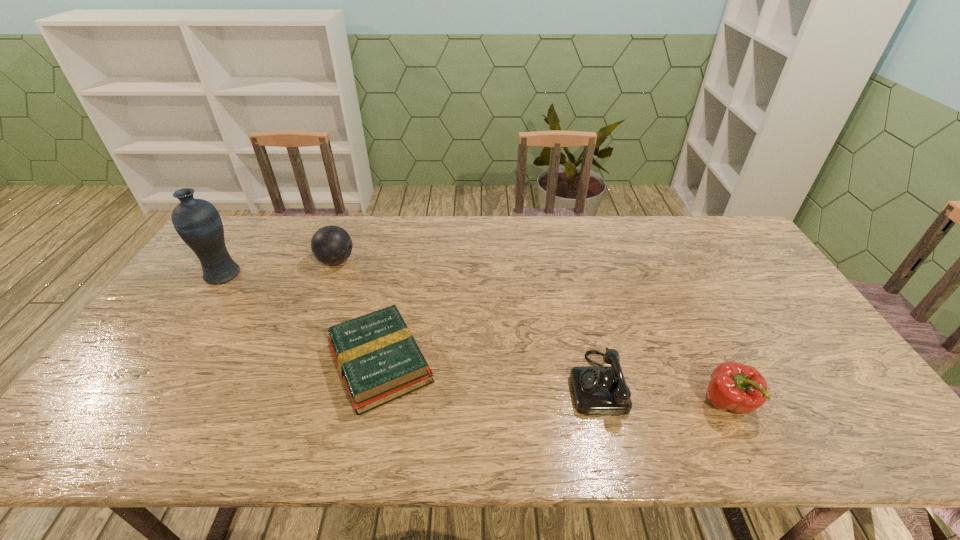
In the image, there is a desktop. Identify the location of vacant space at the far edge. The width and height of the screenshot is (960, 540). (642, 225).

The height and width of the screenshot is (540, 960). What are the coordinates of `vacant space at the near edge` in the screenshot? It's located at (537, 423).

You are a GUI agent. You are given a task and a screenshot of the screen. Output one action in this format:
    pyautogui.click(x=<x>, y=<y>)
    Task: Click on the free space at the left edge of the desktop
    
    Given the screenshot: What is the action you would take?
    pyautogui.click(x=225, y=294)

Image resolution: width=960 pixels, height=540 pixels. In order to click on vacant area between the fourth object from left to right and the vase in this screenshot , I will do `click(410, 328)`.

The width and height of the screenshot is (960, 540). In order to click on vacant space that is in between the leftmost object and the fourth object from right to left in this screenshot , I will do `click(279, 268)`.

You are a GUI agent. You are given a task and a screenshot of the screen. Output one action in this format:
    pyautogui.click(x=<x>, y=<y>)
    Task: Click on the free space that is in between the third object from left to right and the leftmost object
    
    Given the screenshot: What is the action you would take?
    pyautogui.click(x=301, y=319)

At what (x,y) coordinates should I click in order to perform the action: click on free point between the bowling ball and the tallest object. Please return your answer as a coordinate pair (x, y). Looking at the image, I should click on (279, 268).

Locate an element on the screen. Image resolution: width=960 pixels, height=540 pixels. empty space between the tallest object and the second object from right to left is located at coordinates (410, 328).

I want to click on vacant point located between the second object from left to right and the second object from right to left, so click(467, 322).

This screenshot has width=960, height=540. What are the coordinates of `unoccupied position between the tallest object and the rightmost object` in the screenshot? It's located at (475, 339).